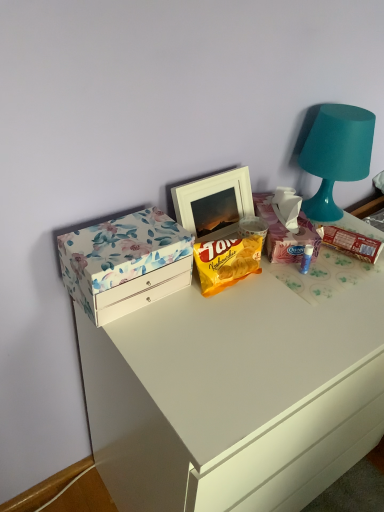
Question: Are brown cardboard snack at right, which ranks as the 1th snack in right-to-left order, and floral paper box at left located far from each other?

Choices:
 (A) yes
 (B) no

Answer: (B)

Question: Does brown cardboard snack at right, which ranks as the 1th snack in right-to-left order, come behind floral paper box at left?

Choices:
 (A) yes
 (B) no

Answer: (A)

Question: Is brown cardboard snack at right, which ranks as the 1th snack in right-to-left order, bigger than floral paper box at left?

Choices:
 (A) no
 (B) yes

Answer: (A)

Question: Is brown cardboard snack at right, which ranks as the 1th snack in right-to-left order, taller than floral paper box at left?

Choices:
 (A) yes
 (B) no

Answer: (B)

Question: Does brown cardboard snack at right, which ranks as the 1th snack in right-to-left order, appear on the right side of floral paper box at left?

Choices:
 (A) no
 (B) yes

Answer: (B)

Question: From a real-world perspective, is floral cardboard box at upper right positioned above or below white glossy drawer at upper left?

Choices:
 (A) above
 (B) below

Answer: (A)

Question: In terms of size, does floral cardboard box at upper right appear bigger or smaller than white glossy drawer at upper left?

Choices:
 (A) small
 (B) big

Answer: (A)

Question: In the image, is floral cardboard box at upper right positioned in front of or behind white glossy drawer at upper left?

Choices:
 (A) front
 (B) behind

Answer: (B)

Question: Considering the positions of point (274, 218) and point (289, 480), is point (274, 218) closer or farther from the camera than point (289, 480)?

Choices:
 (A) farther
 (B) closer

Answer: (A)

Question: In terms of width, does white glossy drawer at upper left look wider or thinner when compared to floral cardboard box at upper right?

Choices:
 (A) thin
 (B) wide

Answer: (B)

Question: From a real-world perspective, relative to floral cardboard box at upper right, is white glossy drawer at upper left vertically above or below?

Choices:
 (A) below
 (B) above

Answer: (A)

Question: From the image's perspective, is white glossy drawer at upper left above or below floral cardboard box at upper right?

Choices:
 (A) below
 (B) above

Answer: (A)

Question: Does point (220, 351) appear closer or farther from the camera than point (291, 262)?

Choices:
 (A) closer
 (B) farther

Answer: (A)

Question: Relative to yellow matte snack packet at center, the first snack when ordered from left to right, is white glossy drawer at upper left in front or behind?

Choices:
 (A) front
 (B) behind

Answer: (A)

Question: Is white glossy drawer at upper left to the left or to the right of yellow matte snack packet at center, the first snack when ordered from left to right, in the image?

Choices:
 (A) right
 (B) left

Answer: (A)